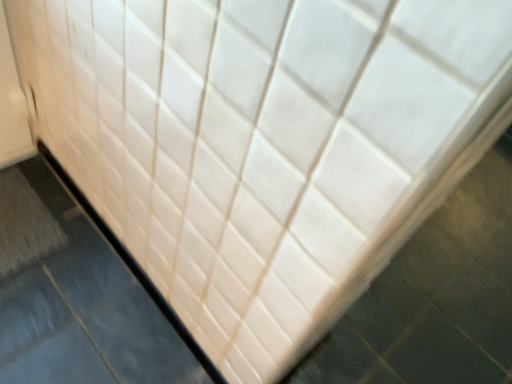
Question: Considering the positions of beige glossy slate at lower left and gray textured bath mat at lower left in the image, is beige glossy slate at lower left wider or thinner than gray textured bath mat at lower left?

Choices:
 (A) wide
 (B) thin

Answer: (B)

Question: From a real-world perspective, is beige glossy slate at lower left positioned above or below gray textured bath mat at lower left?

Choices:
 (A) above
 (B) below

Answer: (A)

Question: In terms of size, does beige glossy slate at lower left appear bigger or smaller than gray textured bath mat at lower left?

Choices:
 (A) small
 (B) big

Answer: (B)

Question: In the image, is gray textured bath mat at lower left positioned in front of or behind beige glossy slate at lower left?

Choices:
 (A) front
 (B) behind

Answer: (B)

Question: Is point (7, 192) closer or farther from the camera than point (53, 357)?

Choices:
 (A) farther
 (B) closer

Answer: (A)

Question: From their relative heights in the image, would you say gray textured bath mat at lower left is taller or shorter than beige glossy slate at lower left?

Choices:
 (A) short
 (B) tall

Answer: (A)

Question: Choose the correct answer: Is gray textured bath mat at lower left inside beige glossy slate at lower left or outside it?

Choices:
 (A) inside
 (B) outside

Answer: (B)